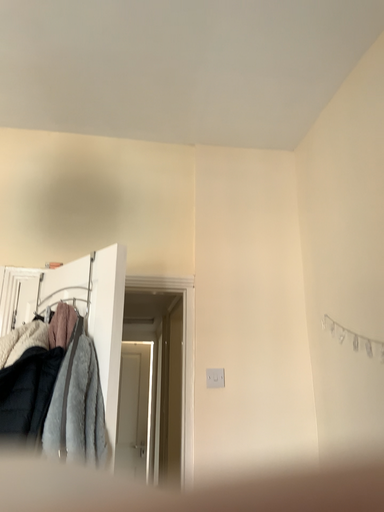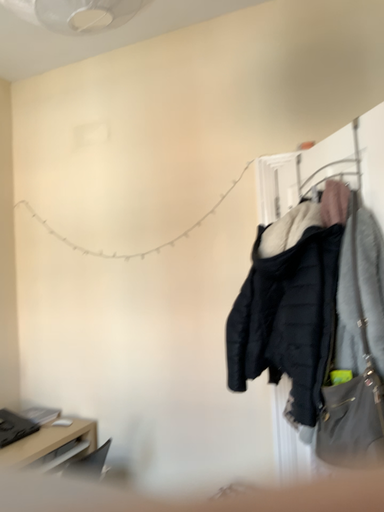
Question: Which way did the camera rotate in the video?

Choices:
 (A) rotated right
 (B) rotated left

Answer: (B)